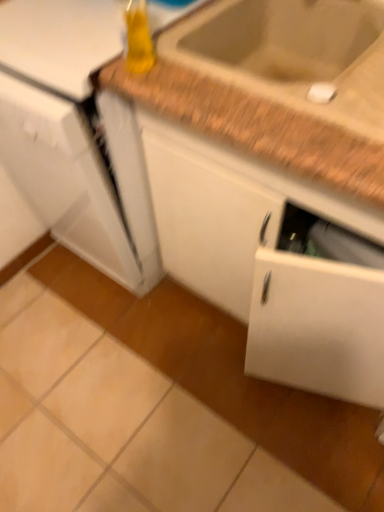
This screenshot has height=512, width=384. Identify the location of free location to the right of translucent yellow bottle at upper center. (206, 76).